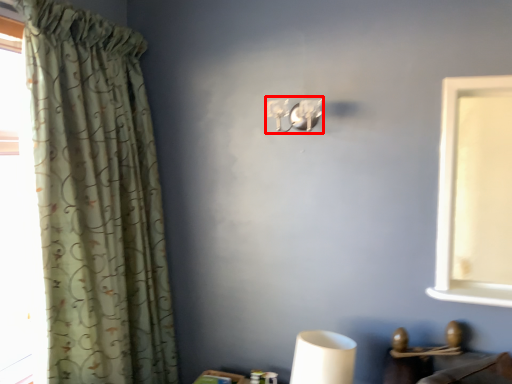
Question: From the image's perspective, what is the correct spatial positioning of lamp (annotated by the red box) in reference to curtain?

Choices:
 (A) above
 (B) below

Answer: (A)